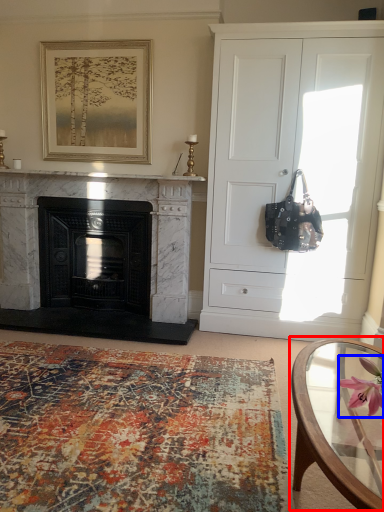
Question: Which of the following is the farthest to the observer, coffee table (highlighted by a red box) or flower (highlighted by a blue box)?

Choices:
 (A) coffee table
 (B) flower

Answer: (B)